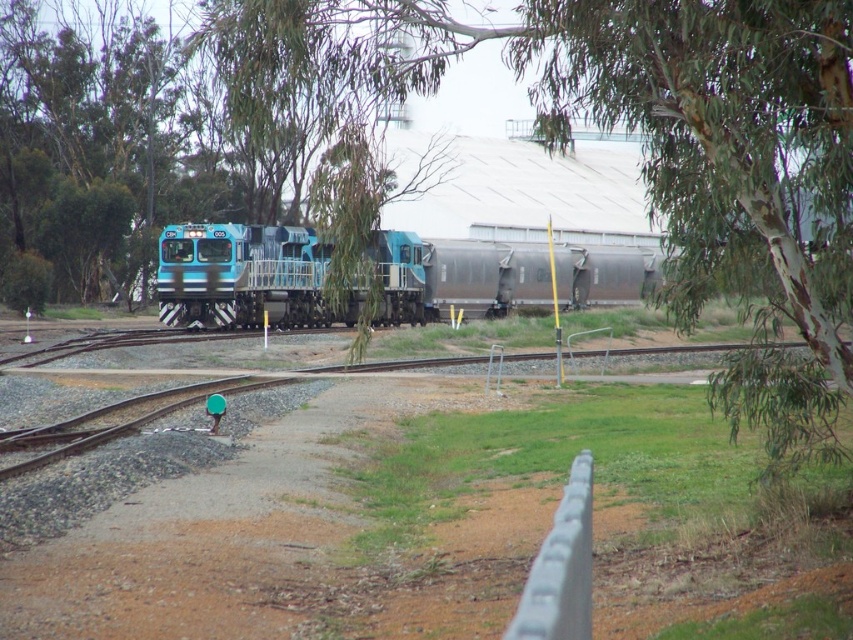
You are a photographer trying to capture a photo of the blue metallic train at center. You notice a green leafy tree at upper center in the background. From the train, which direction should you move to ensure the tree is not blocking the view of the train?

The green leafy tree at upper center is positioned on the right side of the blue metallic train at center, so you should move to the left side of the train to avoid the tree blocking the view.

You are standing at the origin point in the image, which is the lower left corner. You see a point marked at coordinates (244,276). What object is located at that point?

The point at coordinates (244,276) corresponds to the blue metallic train at center.

You are a photographer trying to capture a photo of the blue metallic train at center. You want to ensure the green leafy tree at upper center doesn

The green leafy tree at upper center is larger in size than the blue metallic train at center, so it might block the view of the train if positioned directly in front of it. Consider moving to a position where the tree is either to the side or behind the train to frame the shot properly.